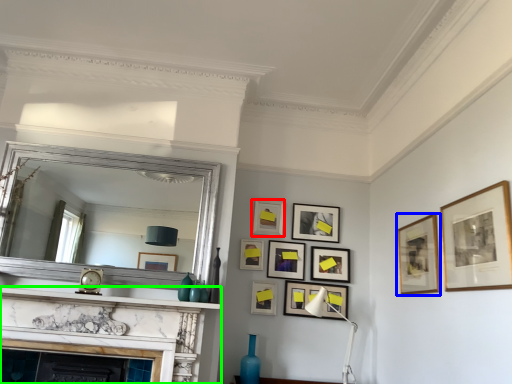
Question: Which is nearer to the picture frame (highlighted by a red box)? picture frame (highlighted by a blue box) or fireplace (highlighted by a green box).

Choices:
 (A) picture frame
 (B) fireplace

Answer: (A)